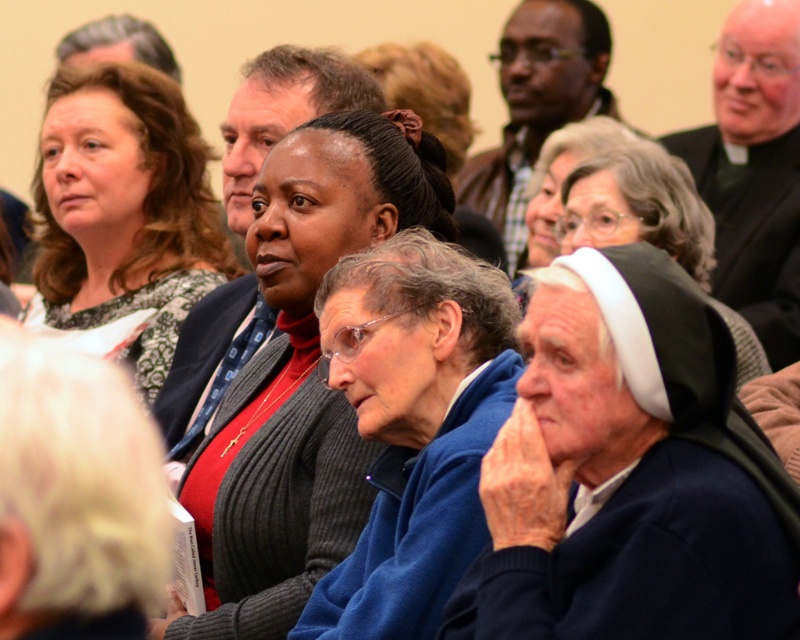
Question: Considering the real-world distances, which object is farthest from the knitted sweater at center?

Choices:
 (A) white cloth at center
 (B) matte black sweater at upper left
 (C) matte black jacket at upper center

Answer: (C)

Question: Can you confirm if knitted sweater at center is smaller than matte black sweater at upper left?

Choices:
 (A) yes
 (B) no

Answer: (A)

Question: Does matte black sweater at upper left appear under matte black jacket at upper center?

Choices:
 (A) yes
 (B) no

Answer: (A)

Question: Which point appears farthest from the camera in this image?

Choices:
 (A) (250, 637)
 (B) (778, 292)

Answer: (B)

Question: Which point is closer to the camera taking this photo?

Choices:
 (A) (232, 612)
 (B) (748, 51)
 (C) (482, 198)
 (D) (134, 301)

Answer: (A)

Question: Does matte black sweater at upper left have a larger size compared to black velvet robe at upper right?

Choices:
 (A) yes
 (B) no

Answer: (B)